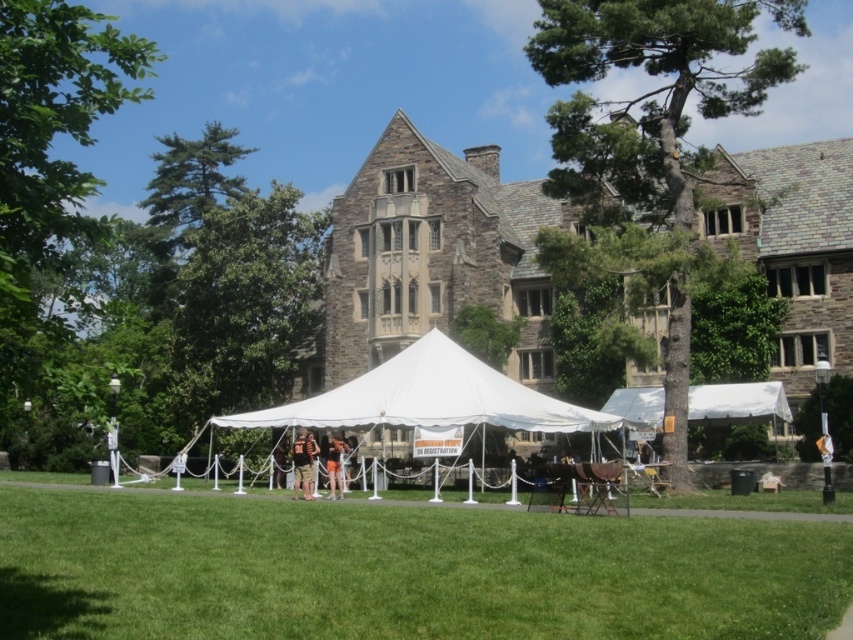
You are a guest at an outdoor event and see the camouflage fabric shirt at center and the orange fabric tent at center. Which object is positioned higher relative to the other?

The camouflage fabric shirt at center is positioned above the orange fabric tent at center, so it is higher.